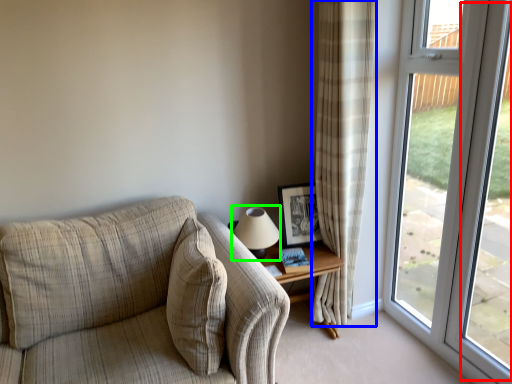
Question: Which object is positioned closest to window screen (highlighted by a red box)? Select from curtain (highlighted by a blue box) and table lamp (highlighted by a green box).

Choices:
 (A) curtain
 (B) table lamp

Answer: (A)